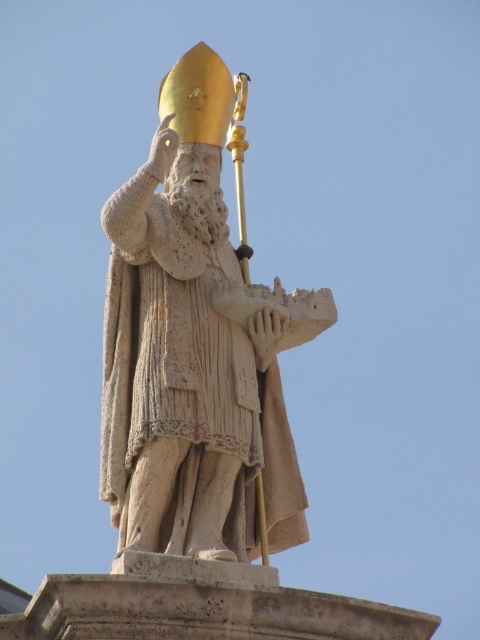
You are an art conservator assessing the statue. You need to determine if the gold polished head at upper center can fit within the width of the matte stone statue at center. Based on the description, can it?

The matte stone statue at center is wider than the gold polished head at upper center, so yes, the gold polished head at upper center can fit within the width of the matte stone statue at center.

You are an art conservator assessing the statue in the scene. You notice a specific point marked at coordinates (196, 355). Based on the statue description, what material is present at this point?

The point at (196, 355) is part of the matte stone statue at center, so the material there is stone.

You are an art conservator examining the statue of a saint. You notice two distinct materials in the image. The matte stone statue at center and the gold polished head at upper center. Which material is positioned to the left of the other?

The matte stone statue at center is positioned on the right side of gold polished head at upper center, so the gold polished head at upper center is to the left of the matte stone statue at center.